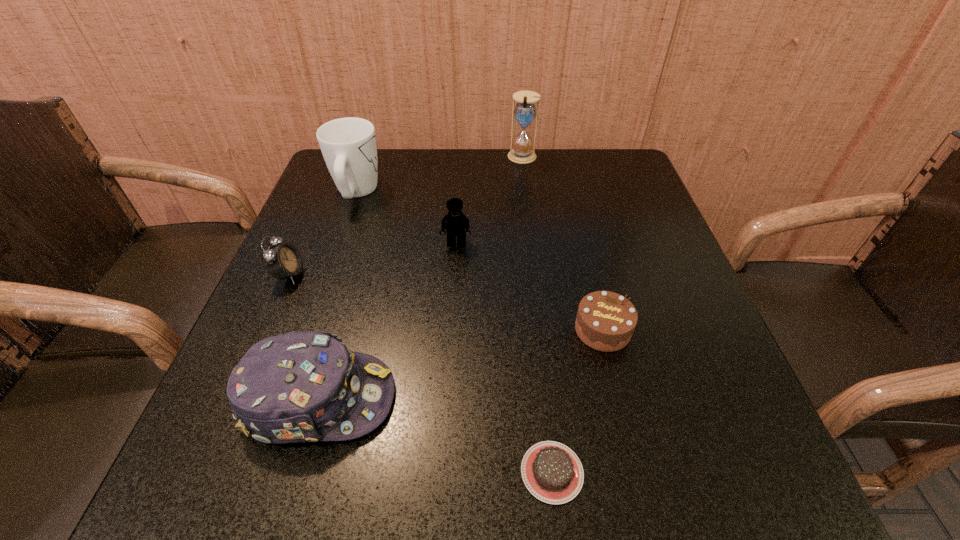
The width and height of the screenshot is (960, 540). What are the coordinates of `blank space located 0.250m on the left of the shortest object` in the screenshot? It's located at (342, 472).

I want to click on hourglass located at the far edge, so click(525, 111).

Locate an element on the screen. Image resolution: width=960 pixels, height=540 pixels. mug that is positioned at the far edge is located at coordinates (348, 145).

At what (x,y) coordinates should I click in order to perform the action: click on headwear that is positioned at the near edge. Please return your answer as a coordinate pair (x, y). Looking at the image, I should click on (297, 387).

The image size is (960, 540). I want to click on chocolate cake that is positioned at the near edge, so click(x=552, y=472).

Locate an element on the screen. The width and height of the screenshot is (960, 540). mug present at the left edge is located at coordinates (348, 145).

This screenshot has width=960, height=540. Find the location of `headwear positioned at the left edge`. headwear positioned at the left edge is located at coordinates (297, 387).

Where is `alarm clock that is at the left edge`? This screenshot has width=960, height=540. alarm clock that is at the left edge is located at coordinates (282, 261).

Locate an element on the screen. The height and width of the screenshot is (540, 960). object that is at the right edge is located at coordinates (605, 321).

The height and width of the screenshot is (540, 960). Identify the location of object that is at the far left corner. (348, 145).